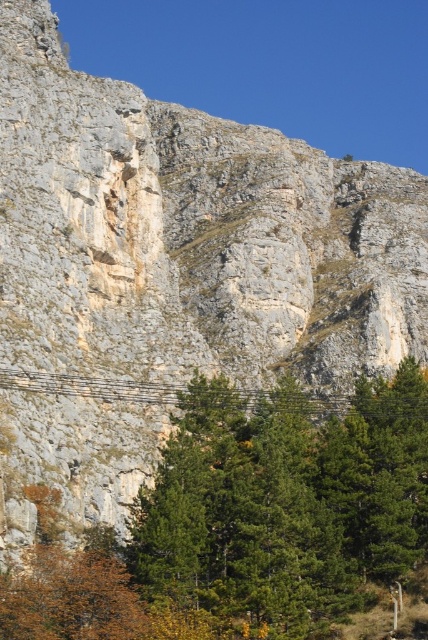
You are a bird looking for a nesting spot. You see a green leafy tree at center and a metallic wire at center. Which one would you choose for nesting?

The green leafy tree at center is much taller than the metallic wire at center, so the bird would choose the green leafy tree at center for nesting because it offers a higher and safer nesting spot.

You are a hiker who wants to climb the cliff. You see a green leafy tree at center and a metallic wire at center. Which object is closer to you?

The green leafy tree at center is positioned under the metallic wire at center, so the metallic wire at center is closer to you.

You are a hiker standing at the base of the cliff and see the green leafy tree at center and the metallic wire at center. Which object is nearer to you?

The green leafy tree at center is closer to the viewer than the metallic wire at center, so the green leafy tree at center is nearer to you.